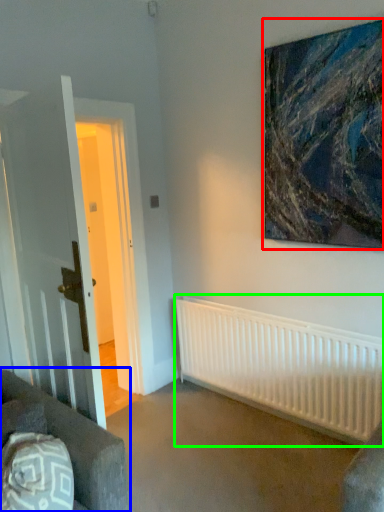
Question: Estimate the real-world distances between objects in this image. Which object is closer to picture frame (highlighted by a red box), studio couch (highlighted by a blue box) or radiator (highlighted by a green box)?

Choices:
 (A) studio couch
 (B) radiator

Answer: (B)